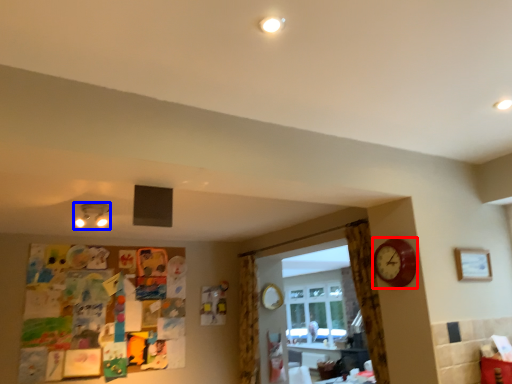
Question: Which point is closer to the camera, clock (highlighted by a red box) or lamp (highlighted by a blue box)?

Choices:
 (A) clock
 (B) lamp

Answer: (A)